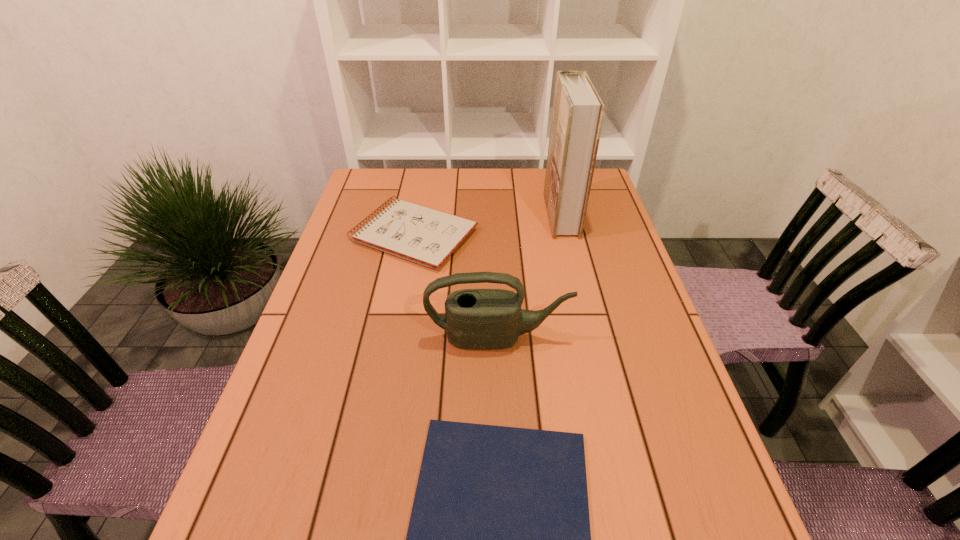
The image size is (960, 540). I want to click on the rightmost object, so click(x=578, y=111).

The image size is (960, 540). In order to click on phonebook in this screenshot , I will do `click(578, 111)`.

Locate an element on the screen. The width and height of the screenshot is (960, 540). the second tallest object is located at coordinates (480, 319).

Locate an element on the screen. This screenshot has height=540, width=960. watering can is located at coordinates (480, 319).

The image size is (960, 540). I want to click on the taller notepad, so click(426, 236).

In order to click on the farther notepad in this screenshot , I will do `click(426, 236)`.

Locate an element on the screen. free space located on the cover of the rightmost object is located at coordinates (477, 214).

Find the location of a particular element. This screenshot has height=540, width=960. vacant space positioned on the cover of the rightmost object is located at coordinates (491, 214).

Identify the location of vacant region located on the cover of the rightmost object. The height and width of the screenshot is (540, 960). (516, 214).

Image resolution: width=960 pixels, height=540 pixels. Find the location of `free region located 0.090m on the spout of the third farthest object`. free region located 0.090m on the spout of the third farthest object is located at coordinates (500, 386).